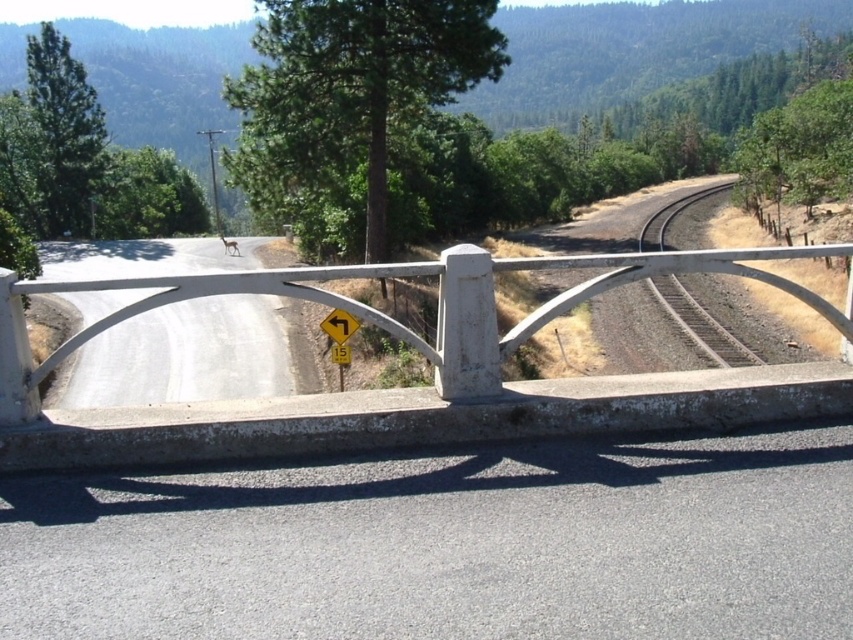
Question: Which point is closer to the camera?

Choices:
 (A) (642, 268)
 (B) (706, 356)

Answer: (A)

Question: Which object appears farthest from the camera in this image?

Choices:
 (A) brown gravel track at right
 (B) white concrete bridge at center

Answer: (A)

Question: Considering the relative positions of white concrete bridge at center and yellow plastic traffic sign at center in the image provided, where is white concrete bridge at center located with respect to yellow plastic traffic sign at center?

Choices:
 (A) below
 (B) above

Answer: (B)

Question: Can you confirm if brown gravel track at right is positioned below yellow plastic traffic sign at center?

Choices:
 (A) yes
 (B) no

Answer: (B)

Question: Does brown gravel track at right have a lesser width compared to yellow plastic traffic sign at center?

Choices:
 (A) no
 (B) yes

Answer: (A)

Question: Considering the real-world distances, which object is closest to the brown gravel track at right?

Choices:
 (A) white concrete bridge at center
 (B) yellow plastic traffic sign at center

Answer: (A)